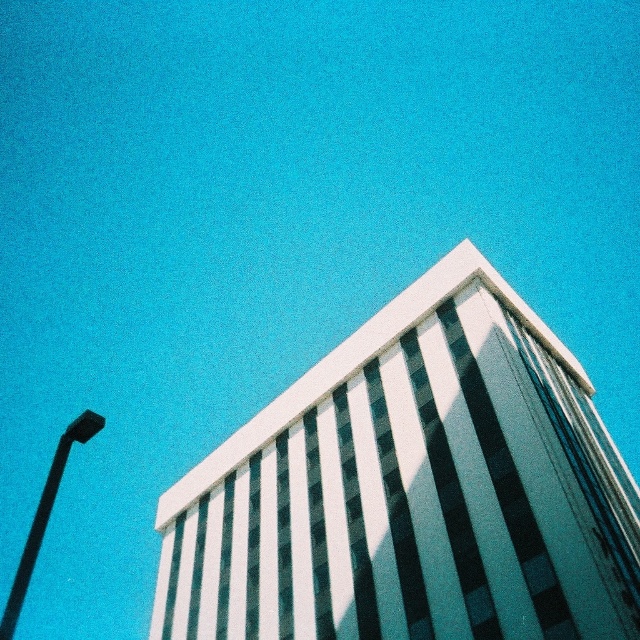
You are a pedestrian standing on the sidewalk looking at the white glass building at center and the black plastic lamp post at left. Which object is positioned to the right of the other?

The white glass building at center is positioned to the right of the black plastic lamp post at left.

You are an architect analyzing the coordinates of the white glass building at center in the image. What are its exact coordinates?

The white glass building at center is located at coordinates point (412, 488).